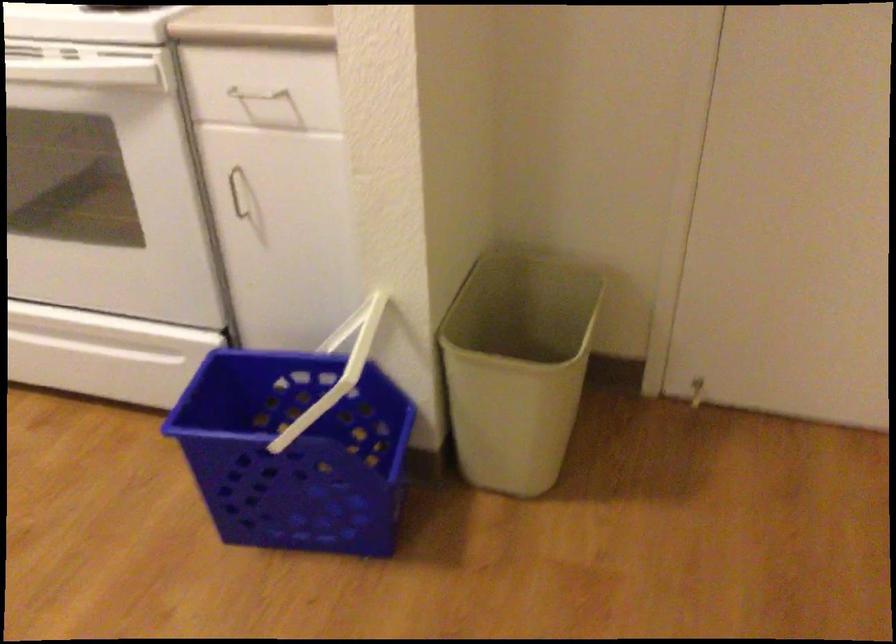
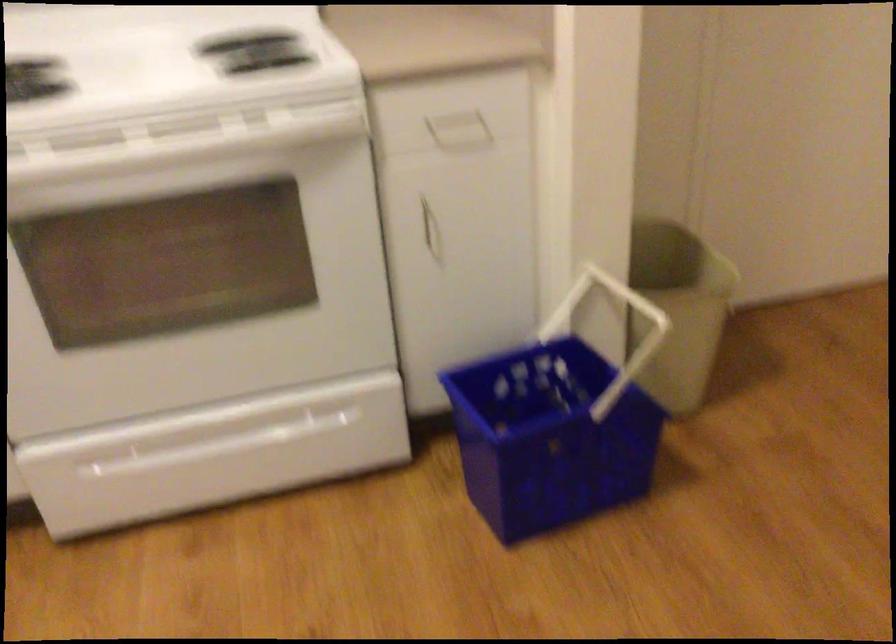
In the second image, find the point that corresponds to pixel 485 377 in the first image.

(678, 308)